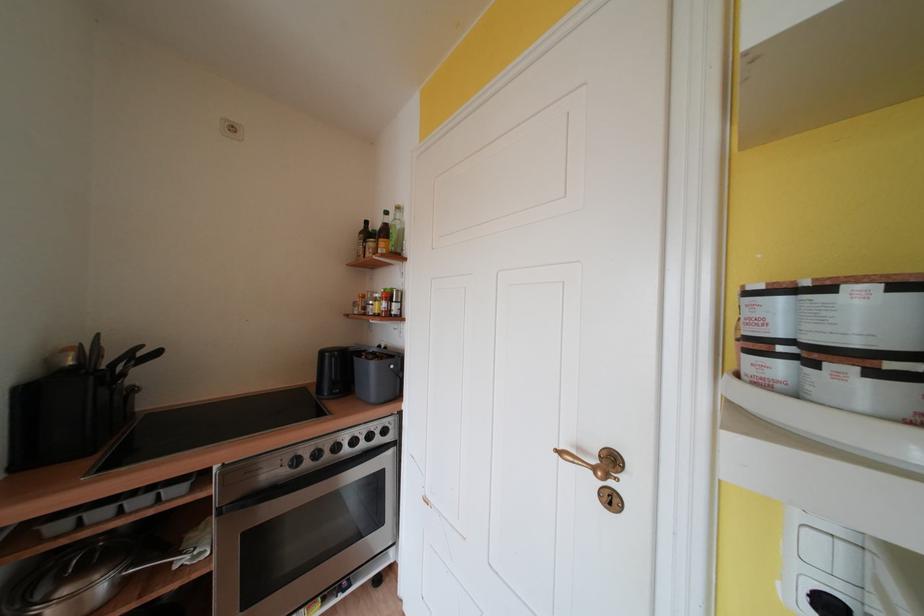
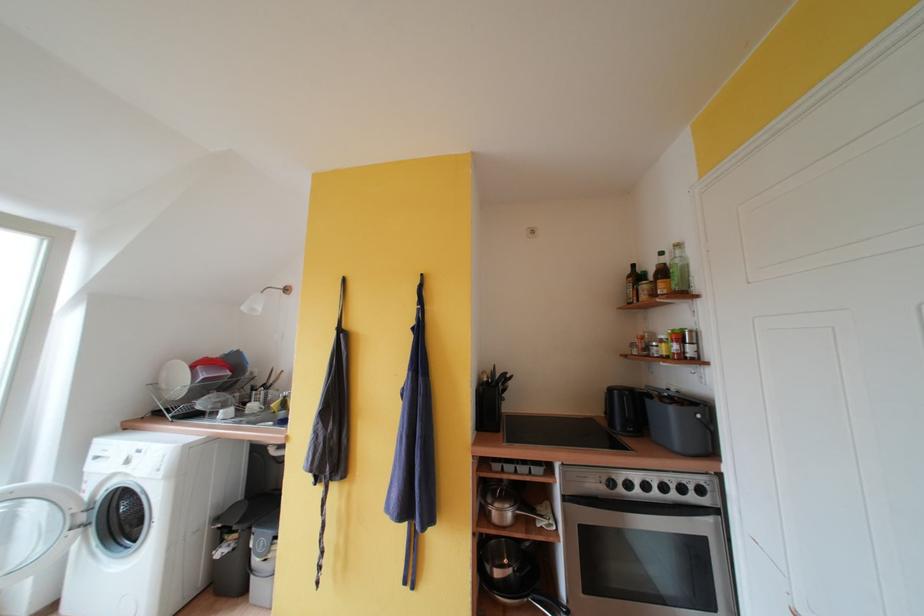
In the second image, find the point that corresponds to (x=379, y=368) in the first image.

(678, 413)